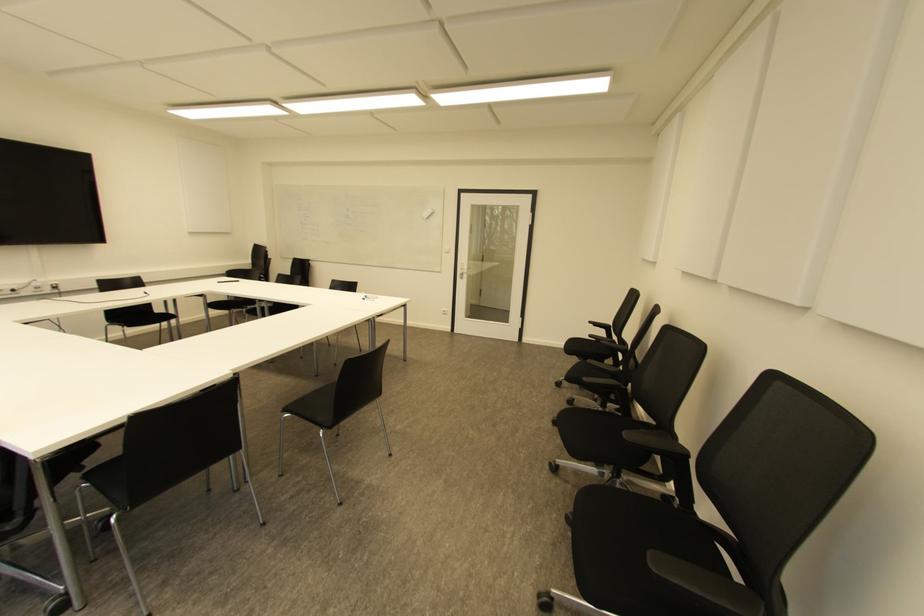
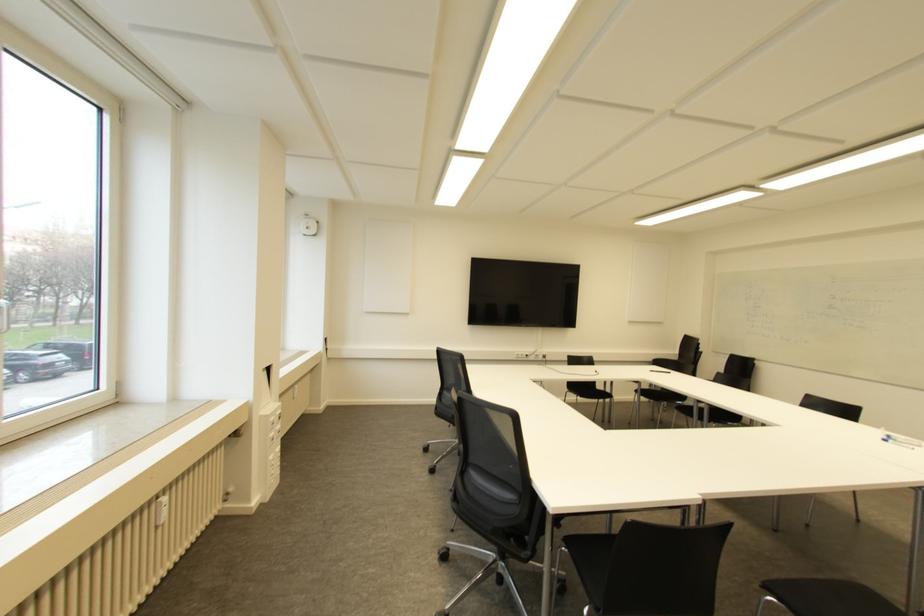
The point at (361, 294) is marked in the first image. Where is the corresponding point in the second image?

(880, 434)